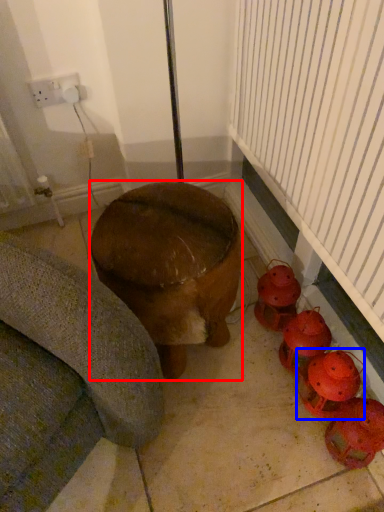
Question: Which object appears closest to the camera in this image, furniture (highlighted by a red box) or toy (highlighted by a blue box)?

Choices:
 (A) furniture
 (B) toy

Answer: (A)